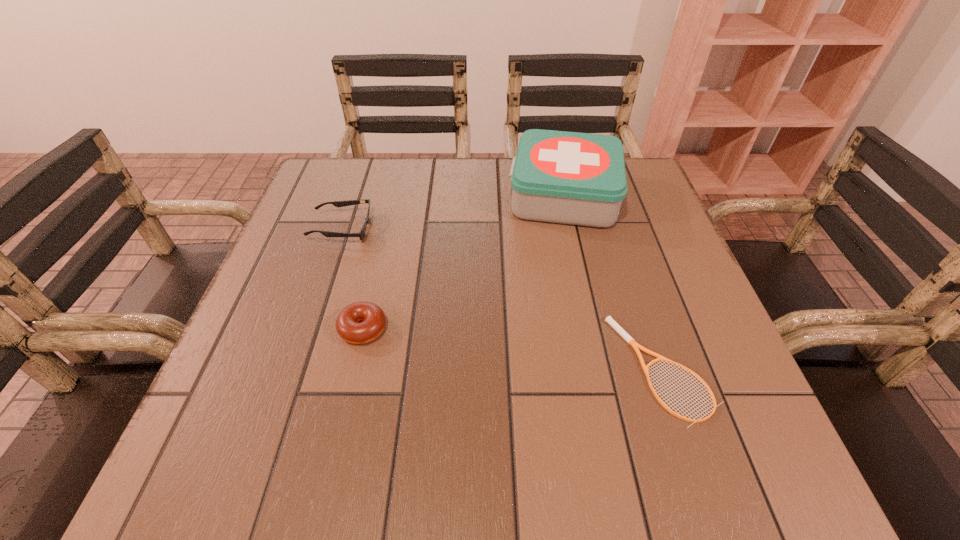
Locate an element on the screen. The image size is (960, 540). object at the near edge is located at coordinates (619, 329).

You are a GUI agent. You are given a task and a screenshot of the screen. Output one action in this format:
    pyautogui.click(x=<x>, y=<y>)
    Task: Click on the object at the left edge
    The height and width of the screenshot is (540, 960).
    Given the screenshot: What is the action you would take?
    pyautogui.click(x=361, y=234)

I want to click on the first-aid kit present at the right edge, so click(574, 178).

Identify the location of tennis racket that is at the right edge. (619, 329).

This screenshot has width=960, height=540. I want to click on object located in the far left corner section of the desktop, so click(361, 234).

The width and height of the screenshot is (960, 540). I want to click on object present at the far right corner, so click(x=574, y=178).

You are a GUI agent. You are given a task and a screenshot of the screen. Output one action in this format:
    pyautogui.click(x=<x>, y=<y>)
    Task: Click on the object that is at the near right corner
    Image resolution: width=960 pixels, height=540 pixels.
    Given the screenshot: What is the action you would take?
    pyautogui.click(x=619, y=329)

Where is `vacant space at the far edge`? vacant space at the far edge is located at coordinates (423, 202).

This screenshot has width=960, height=540. In the image, there is a desktop. Identify the location of vacant space at the near edge. coord(513,437).

I want to click on vacant space at the left edge of the desktop, so click(275, 320).